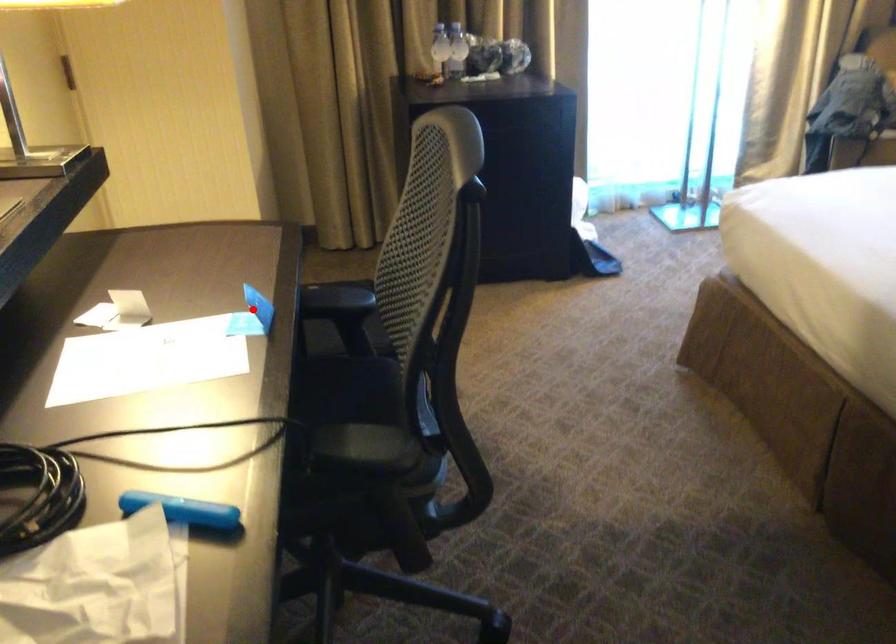
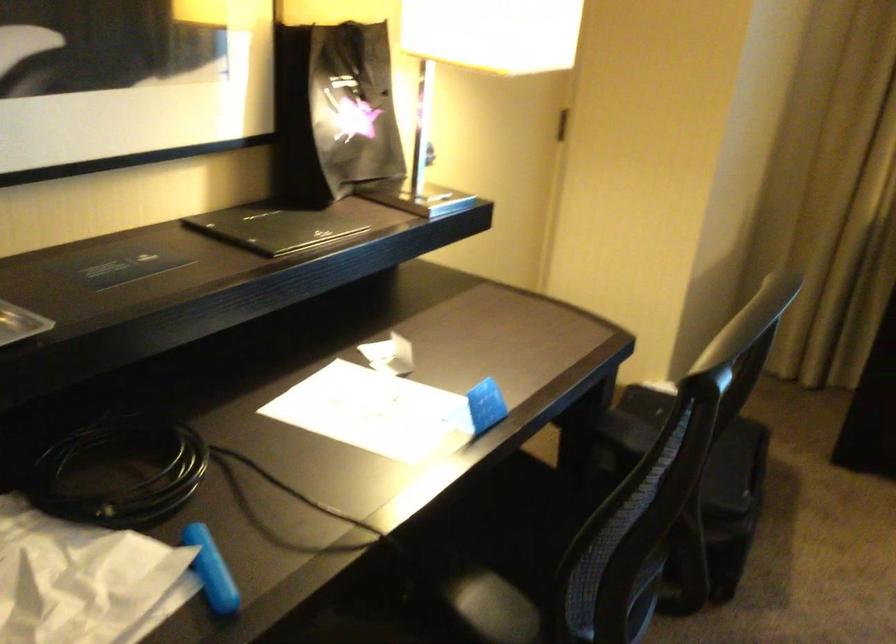
Question: I am providing you with two images of the same scene from different viewpoints. A red point is marked on the first image. At the location where the point appears in image 1, is it still visible in image 2?

Choices:
 (A) Yes
 (B) No

Answer: (A)